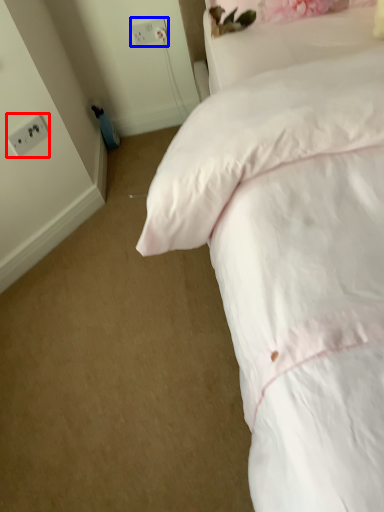
Question: Which object is further to the camera taking this photo, electric outlet (highlighted by a red box) or electric outlet (highlighted by a blue box)?

Choices:
 (A) electric outlet
 (B) electric outlet

Answer: (B)